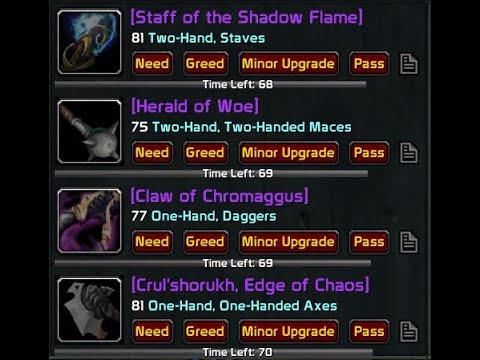
I want to click on divider bar, so click(x=301, y=173).